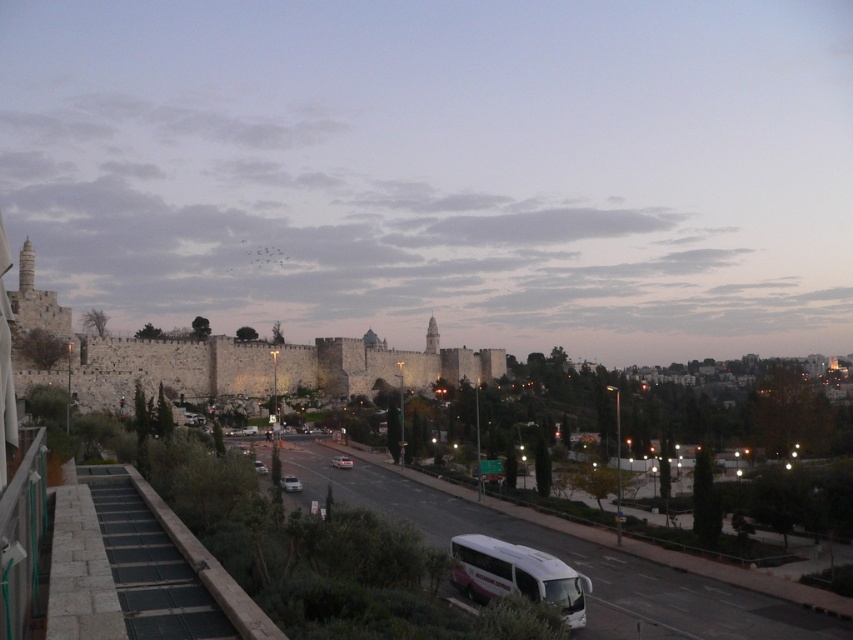
Consider the image. You are a pedestrian standing on the paved road and want to walk to the stone wall at center. Is the white glossy car at center blocking your path?

The stone wall at center is positioned over the white glossy car at center, so the car is directly beneath the wall. Since the wall is a structure, you would need to go around it, but the car is not blocking your path as it is under the wall.

Looking at this image, you are standing at the point marked by the coordinates point (242, 358) in the image. What structure are you currently standing on?

You are standing on the stone wall at center, as the coordinates point (242, 358) represent the stone wall at center.

You are a pedestrian standing on the road and want to cross to the other side. There is a white matte tour bus at lower center and a white glossy car at center. Which object is closer to you as you start crossing?

The white matte tour bus at lower center is closer to you because it is positioned below the white glossy car at center, meaning it is nearer to your starting position on the road.